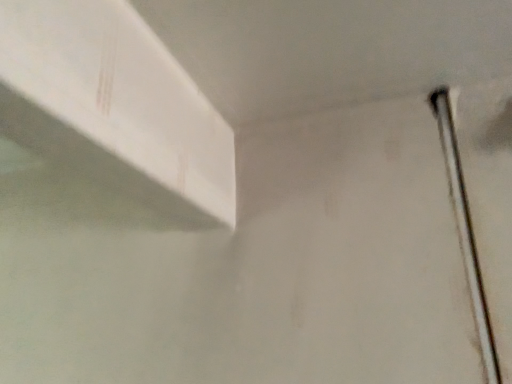
What do you see at coordinates (106, 122) in the screenshot?
I see `white matte exhaust hood at upper left` at bounding box center [106, 122].

I want to click on white matte exhaust hood at upper left, so click(x=106, y=122).

Find the location of `white matte exhaust hood at upper left`. white matte exhaust hood at upper left is located at coordinates (106, 122).